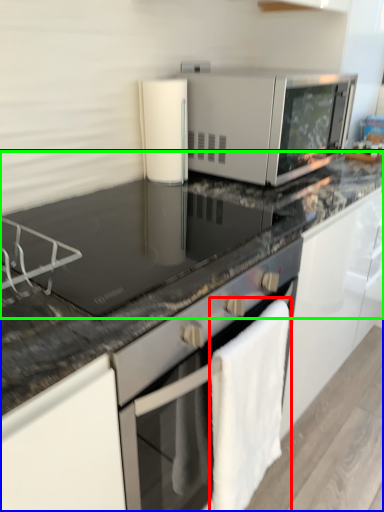
Question: Estimate the real-world distances between objects in this image. Which object is farther from bath towel (highlighted by a red box), countertop (highlighted by a blue box) or countertop (highlighted by a green box)?

Choices:
 (A) countertop
 (B) countertop

Answer: (B)